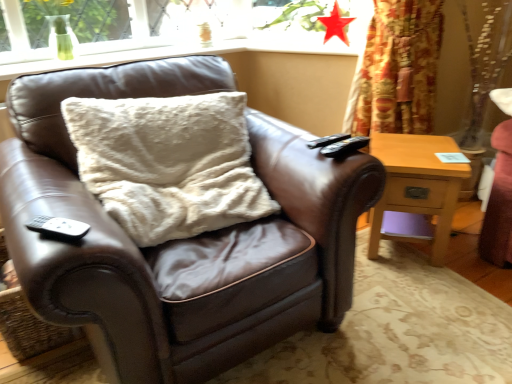
Question: Considering the relative sizes of brown leather chair at center and matte red star at upper center in the image provided, is brown leather chair at center smaller than matte red star at upper center?

Choices:
 (A) yes
 (B) no

Answer: (B)

Question: Could you tell me if brown leather chair at center is facing matte red star at upper center?

Choices:
 (A) no
 (B) yes

Answer: (A)

Question: Considering the relative sizes of brown leather chair at center and matte red star at upper center in the image provided, is brown leather chair at center bigger than matte red star at upper center?

Choices:
 (A) no
 (B) yes

Answer: (B)

Question: From a real-world perspective, is brown leather chair at center located higher than matte red star at upper center?

Choices:
 (A) no
 (B) yes

Answer: (A)

Question: From a real-world perspective, is brown leather chair at center positioned under matte red star at upper center based on gravity?

Choices:
 (A) yes
 (B) no

Answer: (A)

Question: From their relative heights in the image, would you say matte red star at upper center is taller or shorter than black matte remote at lower left, the 1th remote ordered from the bottom?

Choices:
 (A) tall
 (B) short

Answer: (A)

Question: Is matte red star at upper center wider or thinner than black matte remote at lower left, which ranks as the first remote in left-to-right order?

Choices:
 (A) thin
 (B) wide

Answer: (A)

Question: From a real-world perspective, is matte red star at upper center physically located above or below black matte remote at lower left, which ranks as the first remote in left-to-right order?

Choices:
 (A) below
 (B) above

Answer: (B)

Question: Based on their sizes in the image, would you say matte red star at upper center is bigger or smaller than black matte remote at lower left, the 2th remote when ordered from back to front?

Choices:
 (A) small
 (B) big

Answer: (B)

Question: From a real-world perspective, is fuzzy white pillow at center physically located above or below brown leather chair at center?

Choices:
 (A) below
 (B) above

Answer: (B)

Question: From their relative heights in the image, would you say fuzzy white pillow at center is taller or shorter than brown leather chair at center?

Choices:
 (A) tall
 (B) short

Answer: (B)

Question: Considering their positions, is fuzzy white pillow at center located in front of or behind brown leather chair at center?

Choices:
 (A) behind
 (B) front

Answer: (A)

Question: Is point (201, 104) positioned closer to the camera than point (93, 211)?

Choices:
 (A) farther
 (B) closer

Answer: (A)

Question: From a real-world perspective, is matte red star at upper center above or below black plastic remote at upper right, the 2th remote from the left?

Choices:
 (A) above
 (B) below

Answer: (A)

Question: Considering the positions of matte red star at upper center and black plastic remote at upper right, the 2th remote in the bottom-to-top sequence, in the image, is matte red star at upper center bigger or smaller than black plastic remote at upper right, the 2th remote in the bottom-to-top sequence,?

Choices:
 (A) big
 (B) small

Answer: (A)